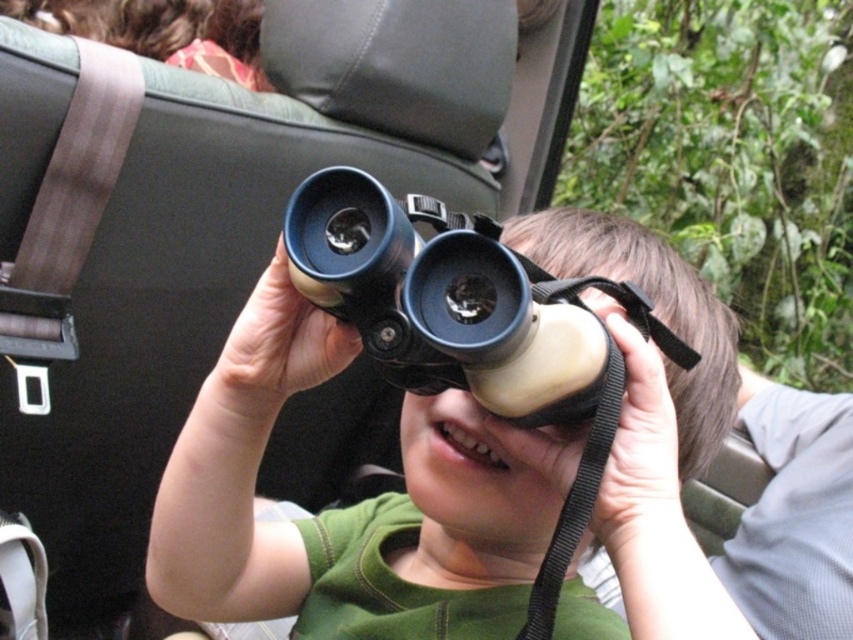
You are a child in a safari jeep trying to hold both the matte black binoculars at center and the black rubber binoculars at center. Which pair is wider?

The matte black binoculars at center are wider than the black rubber binoculars at center.

You are the child in the image and want to hand the matte black binoculars at center to someone sitting across from you. Can you reach them without moving your body?

The matte black binoculars at center are 16.07 inches away from the viewer. Since the average arm length of a child is around 15 inches, it might be difficult to reach them without moving.

You are a parent trying to choose between the matte black binoculars at center and the black rubber binoculars at center for your child to use during the safari. Based on the image, which pair is taller?

The matte black binoculars at center are taller than the black rubber binoculars at center.